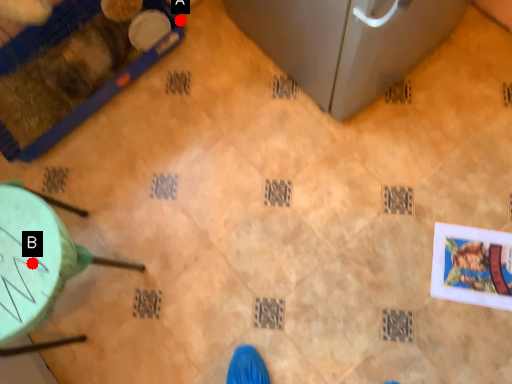
Question: Two points are circled on the image, labeled by A and B beside each circle. Which point appears closest to the camera in this image?

Choices:
 (A) A is closer
 (B) B is closer

Answer: (B)